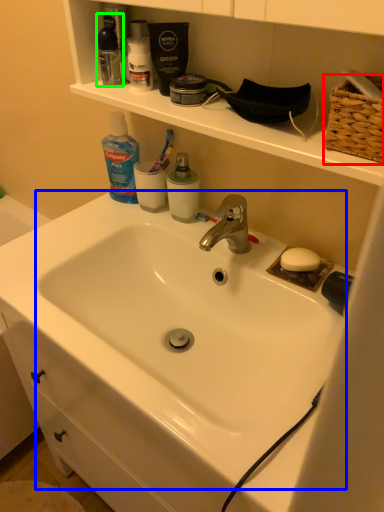
Question: Based on their relative distances, which object is farther from basket (highlighted by a red box)? Choose from sink (highlighted by a blue box) and mouthwash (highlighted by a green box).

Choices:
 (A) sink
 (B) mouthwash

Answer: (B)